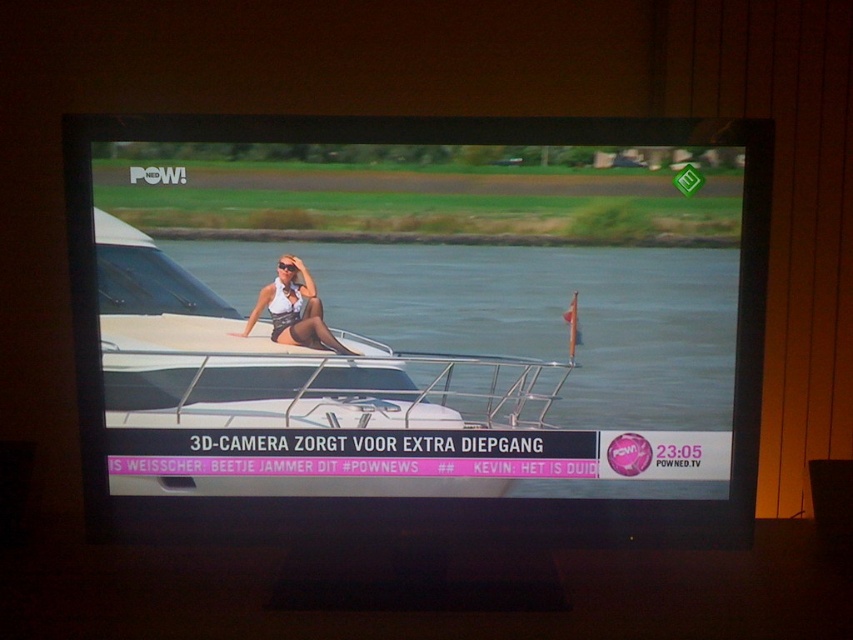
Does white glossy boat at center appear over clear water at center?

Actually, white glossy boat at center is below clear water at center.

Is point (488, 150) behind point (361, 284)?

No.

This screenshot has width=853, height=640. Identify the location of white glossy boat at center. (421, 326).

Find the location of `clear water at center`. clear water at center is located at coordinates (529, 314).

What do you see at coordinates (529, 314) in the screenshot?
I see `clear water at center` at bounding box center [529, 314].

Where is `clear water at center`? clear water at center is located at coordinates (529, 314).

Consider the image. Is white glossy boat at center to the right of matte white bikini at center from the viewer's perspective?

Correct, you'll find white glossy boat at center to the right of matte white bikini at center.

Does white glossy boat at center have a smaller size compared to matte white bikini at center?

Actually, white glossy boat at center might be larger than matte white bikini at center.

I want to click on white glossy boat at center, so click(x=421, y=326).

Locate an element on the screen. This screenshot has width=853, height=640. white glossy boat at center is located at coordinates (421, 326).